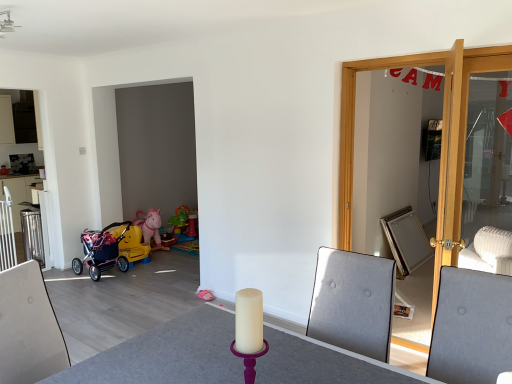
What do you see at coordinates (471, 327) in the screenshot?
I see `gray fabric swivel chair at right` at bounding box center [471, 327].

Where is `light wood door at right`? Image resolution: width=512 pixels, height=384 pixels. light wood door at right is located at coordinates (475, 168).

This screenshot has height=384, width=512. What do you see at coordinates (111, 249) in the screenshot? I see `pink fabric stroller at lower left` at bounding box center [111, 249].

Find the location of a particular element. The height and width of the screenshot is (384, 512). white matte round table at center is located at coordinates pos(168,354).

Describe the element at coordinates (6, 120) in the screenshot. The height and width of the screenshot is (384, 512). I see `matte white cabinet at upper left` at that location.

I want to click on gray fabric swivel chair at right, so click(x=471, y=327).

From a real-world perspective, is light wood door at right above or below white matte round table at center?

light wood door at right is above white matte round table at center.

Are light wood door at right and white matte round table at center beside each other?

No, light wood door at right is not with white matte round table at center.

Looking at this image, does light wood door at right have a greater width compared to white matte round table at center?

No.

Looking at this image, which object is positioned more to the left, matte white cabinet at upper left or pink fabric stroller at lower left?

From the viewer's perspective, matte white cabinet at upper left appears more on the left side.

Can you tell me how much matte white cabinet at upper left and pink fabric stroller at lower left differ in facing direction?

There is a 0.974-degree angle between the facing directions of matte white cabinet at upper left and pink fabric stroller at lower left.

Measure the distance between matte white cabinet at upper left and pink fabric stroller at lower left.

A distance of 5.32 feet exists between matte white cabinet at upper left and pink fabric stroller at lower left.

In order to click on cabinetry that is above the pink fabric stroller at lower left (from a real-world perspective) in this screenshot , I will do `click(6, 120)`.

Between point (121, 271) and point (8, 143), which one is positioned in front?

The point (8, 143) is closer.

From a real-world perspective, is pink fabric stroller at lower left located higher than matte white cabinet at upper left?

Incorrect, from a real-world perspective, pink fabric stroller at lower left is lower than matte white cabinet at upper left.

Considering the sizes of objects pink fabric stroller at lower left and matte white cabinet at upper left in the image provided, who is thinner, pink fabric stroller at lower left or matte white cabinet at upper left?

With smaller width is matte white cabinet at upper left.

Which of these two, pink fabric stroller at lower left or matte white cabinet at upper left, stands shorter?

pink fabric stroller at lower left is shorter.

Considering the sizes of objects light wood door at right and pink fabric stroller at lower left in the image provided, who is wider, light wood door at right or pink fabric stroller at lower left?

With larger width is pink fabric stroller at lower left.

Considering the relative sizes of light wood door at right and pink fabric stroller at lower left in the image provided, is light wood door at right smaller than pink fabric stroller at lower left?

Correct, light wood door at right occupies less space than pink fabric stroller at lower left.

Which is behind, point (447, 103) or point (133, 232)?

The point (133, 232) is more distant.

Can you see light wood door at right touching pink fabric stroller at lower left?

No, light wood door at right is not in contact with pink fabric stroller at lower left.

Does pink fabric stroller at lower left turn towards light wood door at right?

Yes, pink fabric stroller at lower left is oriented towards light wood door at right.

Is pink fabric stroller at lower left thinner than light wood door at right?

No.

Considering the positions of objects pink fabric stroller at lower left and light wood door at right in the image provided, who is more to the left, pink fabric stroller at lower left or light wood door at right?

From the viewer's perspective, pink fabric stroller at lower left appears more on the left side.

Is light wood door at right inside pink fabric stroller at lower left?

Definitely not — light wood door at right is not inside pink fabric stroller at lower left.

Identify the location of swivel chair on the left of light wood door at right. This screenshot has width=512, height=384. click(x=471, y=327).

From their relative heights in the image, would you say gray fabric swivel chair at right is taller or shorter than light wood door at right?

Considering their sizes, gray fabric swivel chair at right has less height than light wood door at right.

How much distance is there between gray fabric swivel chair at right and light wood door at right?

gray fabric swivel chair at right and light wood door at right are 2.96 meters apart from each other.

Is gray fabric swivel chair at right facing towards light wood door at right?

No, gray fabric swivel chair at right is not facing towards light wood door at right.

Considering the relative sizes of gray fabric swivel chair at right and pink fabric stroller at lower left in the image provided, is gray fabric swivel chair at right smaller than pink fabric stroller at lower left?

Yes.

Is gray fabric swivel chair at right placed right next to pink fabric stroller at lower left?

No, gray fabric swivel chair at right is not with pink fabric stroller at lower left.

Is pink fabric stroller at lower left surrounded by gray fabric swivel chair at right?

No, pink fabric stroller at lower left is located outside of gray fabric swivel chair at right.

How many degrees apart are the facing directions of gray fabric swivel chair at right and pink fabric stroller at lower left?

The angular difference between gray fabric swivel chair at right and pink fabric stroller at lower left is 90 degrees.

In the image, there is a light wood door at right. Identify the location of round table below it (from a real-world perspective). This screenshot has height=384, width=512. (168, 354).

You are a GUI agent. You are given a task and a screenshot of the screen. Output one action in this format:
    pyautogui.click(x=<x>, y=<y>)
    Task: Click on the cabinetry behind the pink fabric stroller at lower left
    This screenshot has height=384, width=512.
    Given the screenshot: What is the action you would take?
    pyautogui.click(x=6, y=120)

When comparing their distances from gray fabric swivel chair at right, does pink fabric stroller at lower left or matte white cabinet at upper left seem closer?

pink fabric stroller at lower left.

In the scene shown: When comparing their distances from gray fabric swivel chair at right, does pink fabric stroller at lower left or white matte round table at center seem further?

Based on the image, pink fabric stroller at lower left appears to be further to gray fabric swivel chair at right.

When comparing their distances from light wood door at right, does white matte round table at center or pink fabric stroller at lower left seem closer?

The object closer to light wood door at right is white matte round table at center.

Based on their spatial positions, is light wood door at right or pink fabric stroller at lower left further from gray fabric swivel chair at right?

pink fabric stroller at lower left.

Looking at the image, which one is located closer to matte white cabinet at upper left, pink fabric stroller at lower left or light wood door at right?

pink fabric stroller at lower left is closer to matte white cabinet at upper left.

Estimate the real-world distances between objects in this image. Which object is closer to light wood door at right, matte white cabinet at upper left or white matte round table at center?

white matte round table at center.

Looking at the image, which one is located further to pink fabric stroller at lower left, light wood door at right or matte white cabinet at upper left?

Among the two, light wood door at right is located further to pink fabric stroller at lower left.

Which object lies further to the anchor point light wood door at right, gray fabric swivel chair at right or pink fabric stroller at lower left?

pink fabric stroller at lower left is further to light wood door at right.

The image size is (512, 384). Find the location of `swivel chair between white matte round table at center and pink fabric stroller at lower left from front to back`. swivel chair between white matte round table at center and pink fabric stroller at lower left from front to back is located at coordinates (471, 327).

This screenshot has width=512, height=384. I want to click on stroller between white matte round table at center and matte white cabinet at upper left along the z-axis, so click(111, 249).

The height and width of the screenshot is (384, 512). I want to click on door between white matte round table at center and matte white cabinet at upper left in the front-back direction, so click(x=475, y=168).

What are the coordinates of `stroller between matte white cabinet at upper left and light wood door at right in the horizontal direction` in the screenshot? It's located at (111, 249).